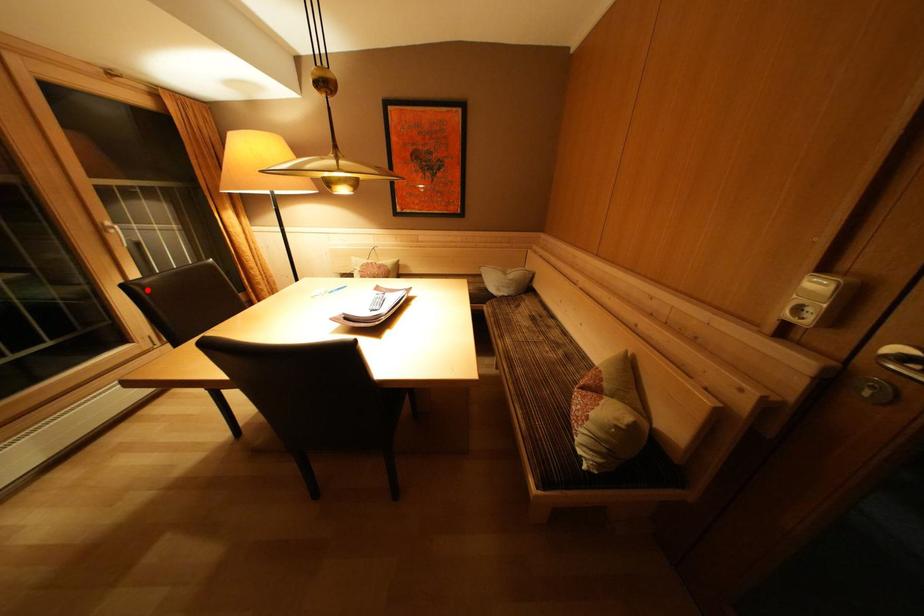
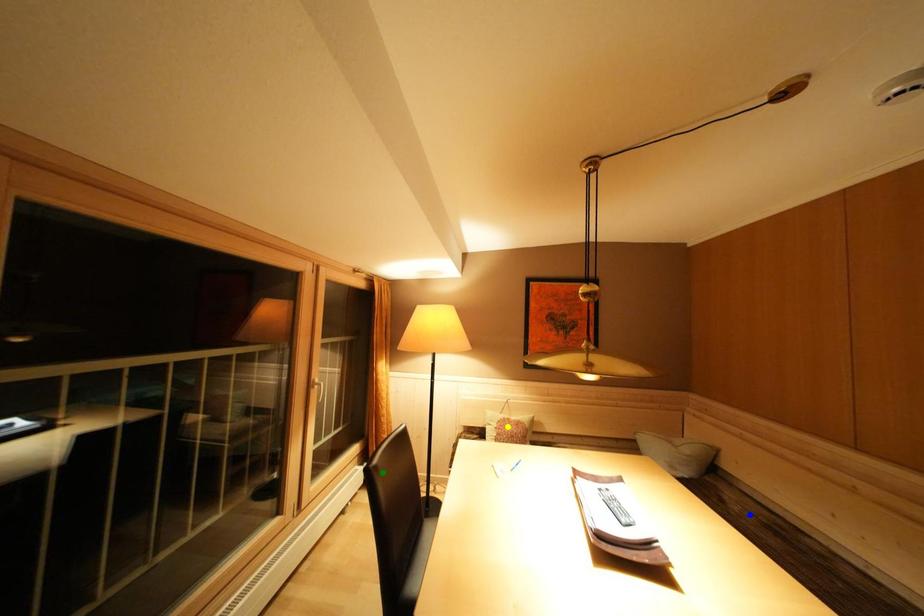
Question: I am providing you with two images of the same scene from different viewpoints. A red point is marked on the first image. You are given multiple points on the second image. Can you choose the point in image 2 that corresponds to the point in image 1?

Choices:
 (A) yellow point
 (B) blue point
 (C) green point

Answer: (C)